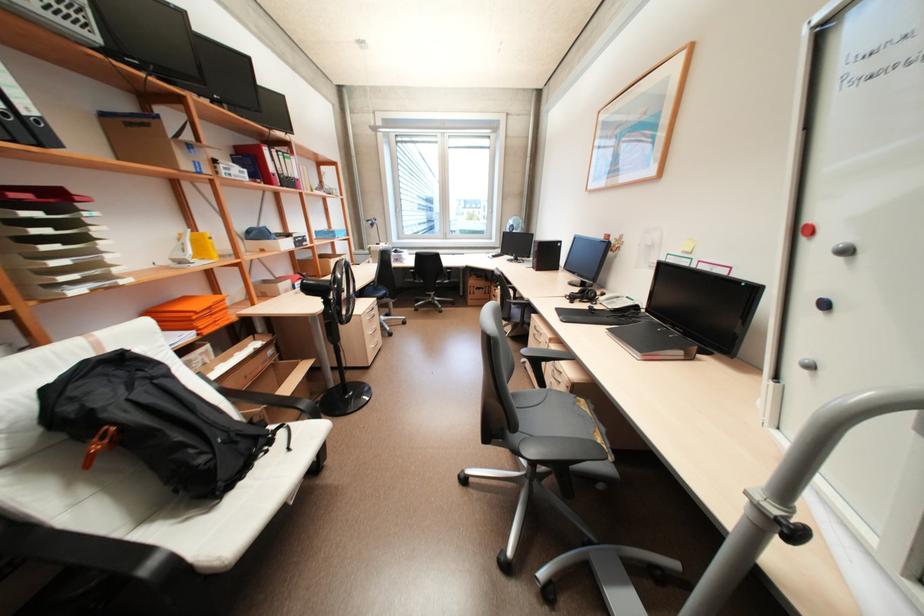
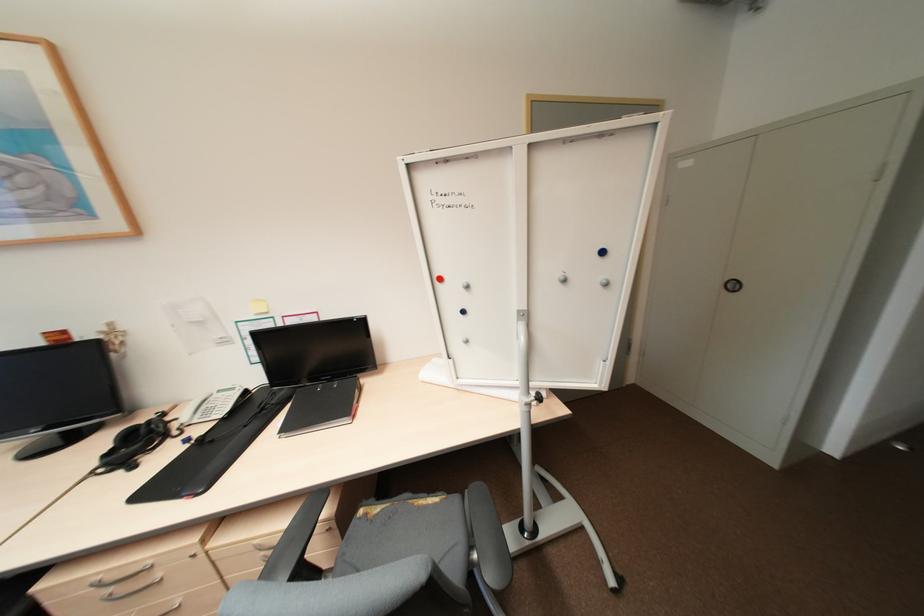
Find the pixel in the second image that matches pixel 610 429 in the first image.

(415, 493)